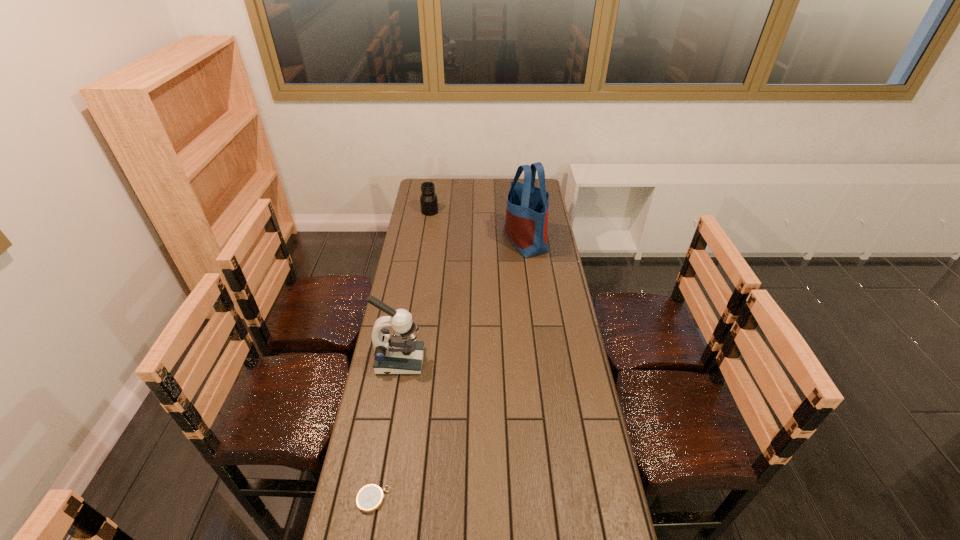
Select which object is the third closest to the jar. Please provide its 2D coordinates. Your answer should be formatted as a tuple, i.e. [(x, y)], where the tuple contains the x and y coordinates of a point satisfying the conditions above.

[(370, 497)]

Find the location of a particular element. This screenshot has width=960, height=540. free space in the image that satisfies the following two spatial constraints: 1. on the back side of the third tallest object; 2. on the left side of the compass is located at coordinates (424, 212).

At what (x,y) coordinates should I click in order to perform the action: click on free location that satisfies the following two spatial constraints: 1. on the back side of the second shortest object; 2. on the left side of the shortest object. Please return your answer as a coordinate pair (x, y). Looking at the image, I should click on (424, 212).

Where is `vacant space that satisfies the following two spatial constraints: 1. on the front side of the tallest object; 2. at the eyepiece of the third shortest object`? The height and width of the screenshot is (540, 960). vacant space that satisfies the following two spatial constraints: 1. on the front side of the tallest object; 2. at the eyepiece of the third shortest object is located at coordinates (540, 361).